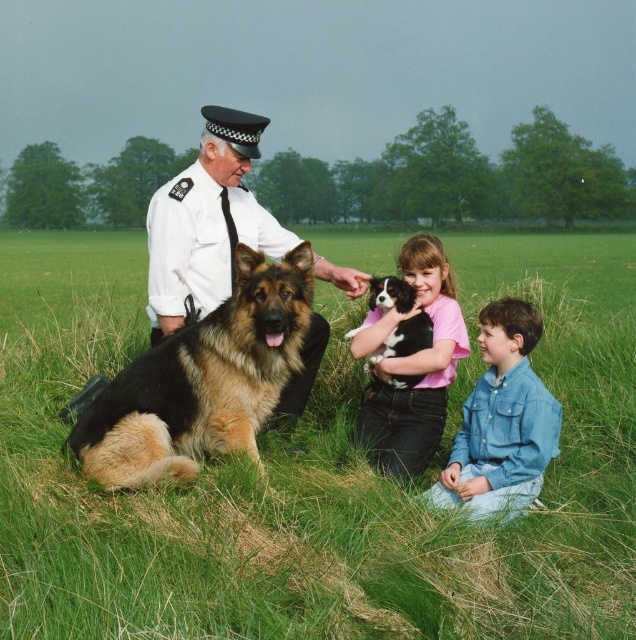
You are a photographer trying to capture a photo of the brown and black fur at left and the smooth white shirt at center. Which object should you focus on first if you want to ensure both are in sharp focus, considering their sizes?

The brown and black fur at left is smaller than the smooth white shirt at center. To ensure both are in sharp focus, you should focus on the smaller object first, which is the brown and black fur at left, as it requires more precise focus due to its smaller size.

What is the object located at the coordinates point (207,221)?

The object located at point (207,221) is the smooth white shirt at center.